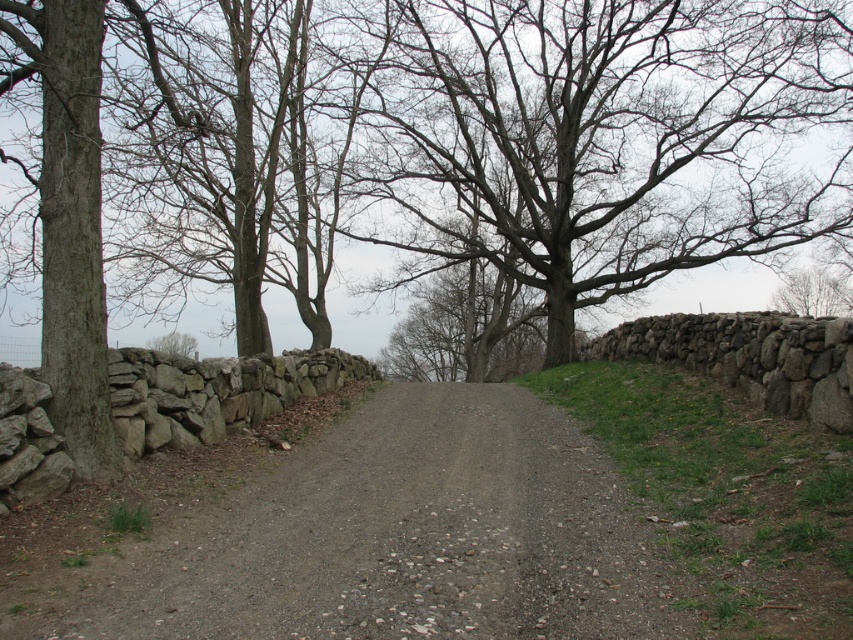
You are standing at the point marked as point (602,138) in the image. Looking around, you see the dirt path and stone walls. Which direction should you walk to stay on the dirt path?

You should walk along the dirt path towards the right, as the path curves gently to the right and extends into the distance, keeping you on the path.